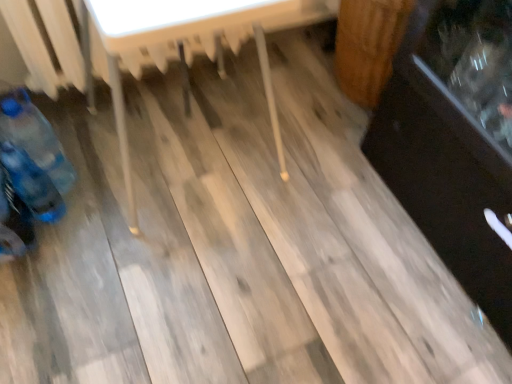
Image resolution: width=512 pixels, height=384 pixels. What are the coordinates of `free location in front of blue plastic bottle at lower left, positioned as the 2th bottle in top-to-bottom order` in the screenshot? It's located at (51, 266).